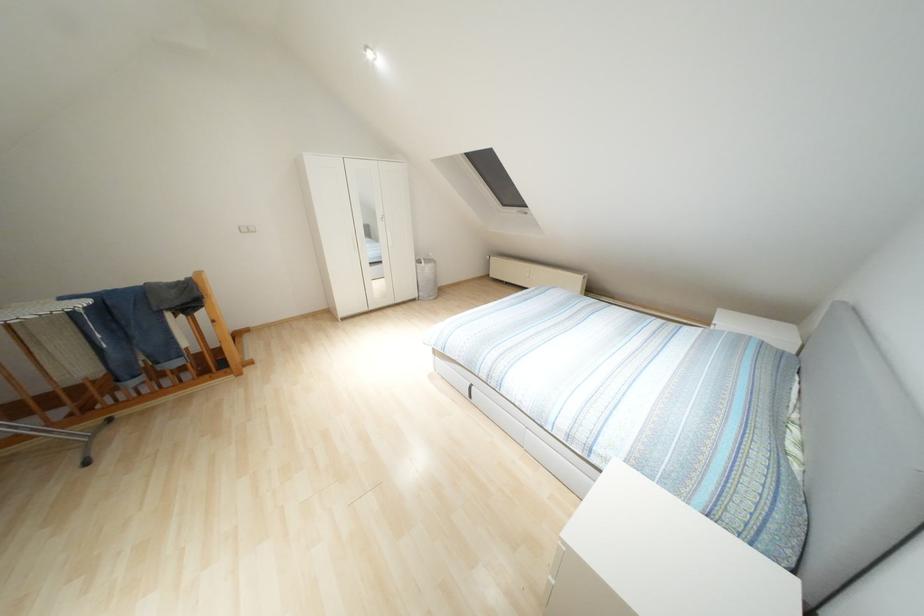
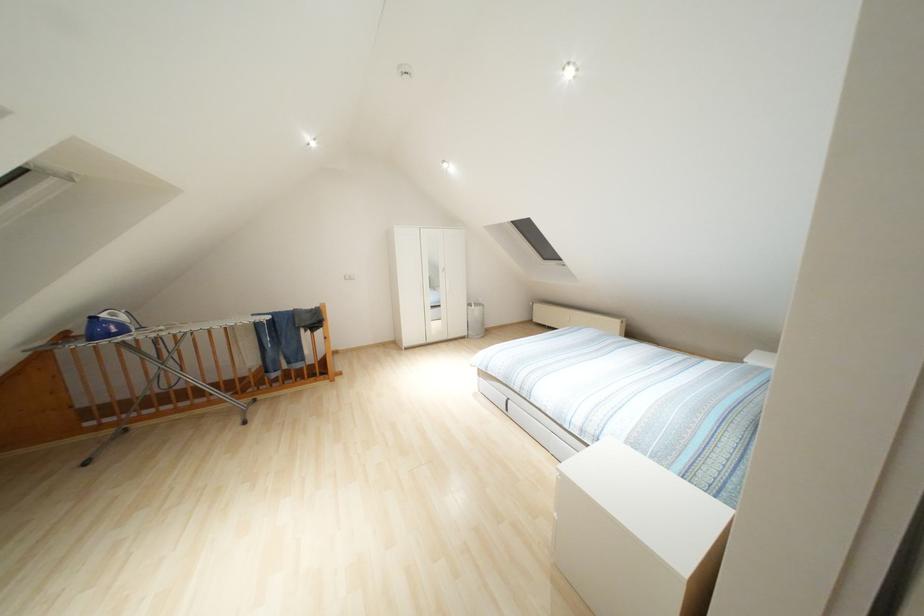
Question: In a continuous first-person perspective shot, in which direction is the camera moving?

Choices:
 (A) Left
 (B) Right
 (C) Forward
 (D) Backward

Answer: (D)